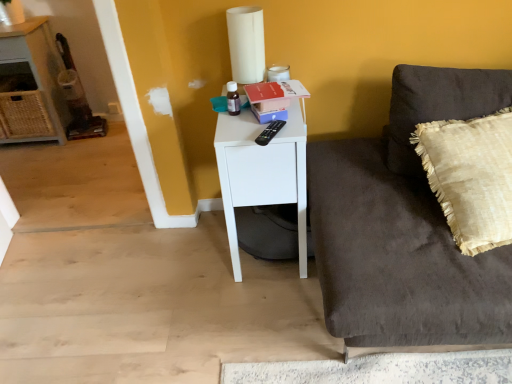
Identify the location of vacant area in front of white matte side table at center. Image resolution: width=512 pixels, height=384 pixels. (252, 316).